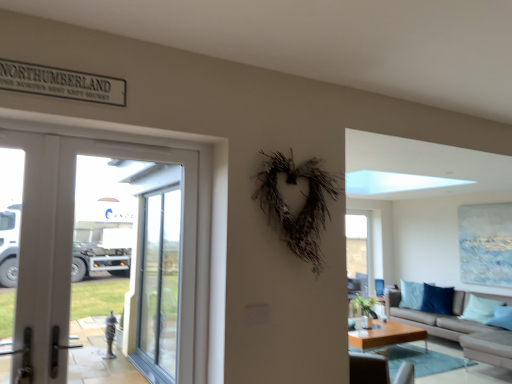
Question: Considering the relative sizes of light brown wooden coffee table at lower center and white glossy door at left in the image provided, is light brown wooden coffee table at lower center wider than white glossy door at left?

Choices:
 (A) no
 (B) yes

Answer: (B)

Question: From the image's perspective, is light brown wooden coffee table at lower center beneath white glossy door at left?

Choices:
 (A) yes
 (B) no

Answer: (A)

Question: Is light brown wooden coffee table at lower center oriented towards white glossy door at left?

Choices:
 (A) no
 (B) yes

Answer: (A)

Question: From the image's perspective, is light brown wooden coffee table at lower center located above white glossy door at left?

Choices:
 (A) no
 (B) yes

Answer: (A)

Question: Is the position of light brown wooden coffee table at lower center more distant than that of white glossy door at left?

Choices:
 (A) yes
 (B) no

Answer: (A)

Question: Looking at their shapes, would you say beige fabric couch at lower right is wider or thinner than light blue fabric pillow at lower right?

Choices:
 (A) thin
 (B) wide

Answer: (B)

Question: Visually, is beige fabric couch at lower right positioned to the left or to the right of light blue fabric pillow at lower right?

Choices:
 (A) left
 (B) right

Answer: (A)

Question: Considering the positions of beige fabric couch at lower right and light blue fabric pillow at lower right in the image, is beige fabric couch at lower right taller or shorter than light blue fabric pillow at lower right?

Choices:
 (A) short
 (B) tall

Answer: (B)

Question: From a real-world perspective, is beige fabric couch at lower right physically located above or below light blue fabric pillow at lower right?

Choices:
 (A) below
 (B) above

Answer: (A)

Question: Would you say white glossy screen door at left, the 1th screen door in the front-to-back sequence, is inside or outside transparent glass window at center?

Choices:
 (A) inside
 (B) outside

Answer: (B)

Question: Relative to transparent glass window at center, is white glossy screen door at left, the 1th screen door in the front-to-back sequence, in front or behind?

Choices:
 (A) behind
 (B) front

Answer: (B)

Question: Is point 65,299 closer or farther from the camera than point 356,261?

Choices:
 (A) closer
 (B) farther

Answer: (A)

Question: Considering the positions of white glossy screen door at left, which is counted as the 2th screen door, starting from the back, and transparent glass window at center in the image, is white glossy screen door at left, which is counted as the 2th screen door, starting from the back, bigger or smaller than transparent glass window at center?

Choices:
 (A) big
 (B) small

Answer: (B)

Question: Based on their sizes in the image, would you say beige fabric couch at lower right is bigger or smaller than transparent glass window at center?

Choices:
 (A) big
 (B) small

Answer: (A)

Question: Visually, is beige fabric couch at lower right positioned to the left or to the right of transparent glass window at center?

Choices:
 (A) right
 (B) left

Answer: (A)